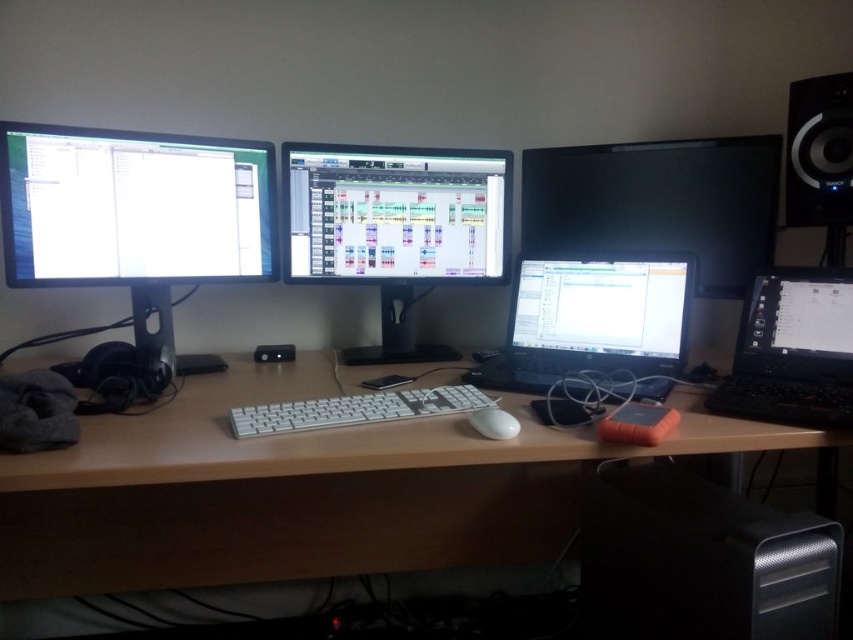
You are setting up a new monitor that requires at least 20 inches of space. You have two monitors in the setup described. Which monitor, the matte black monitor at left or the black glossy monitor at upper right, would you need to check the width of to ensure it meets the space requirement?

The matte black monitor at left has a width less than the black glossy monitor at upper right. Since the new monitor requires at least 20 inches, you should check the width of the matte black monitor at left to confirm it meets the space requirement, as it might be smaller than the other monitor.